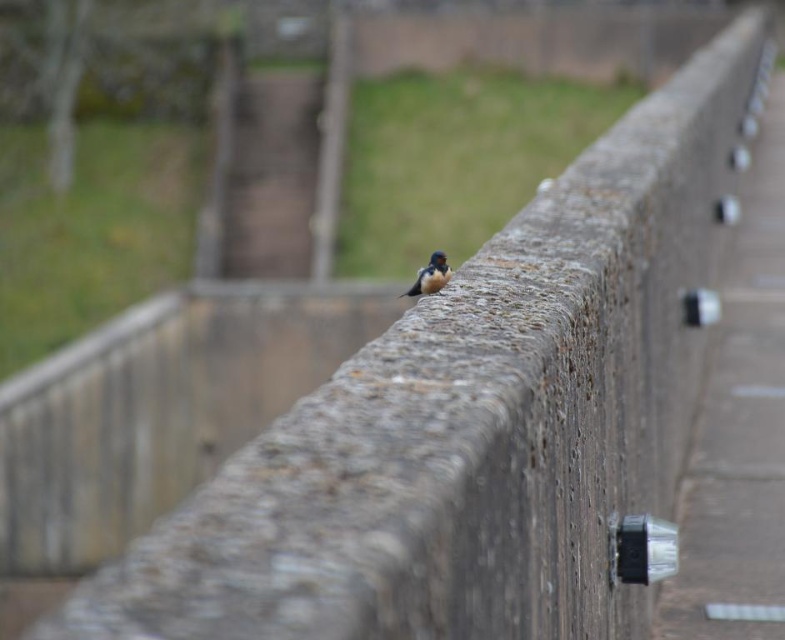
You are a photographer trying to capture the satin plumage bird at center. You notice the concrete at right in the background. Which object takes up more space in the photo?

The concrete at right has a larger size compared to the satin plumage bird at center, so it takes up more space in the photo.